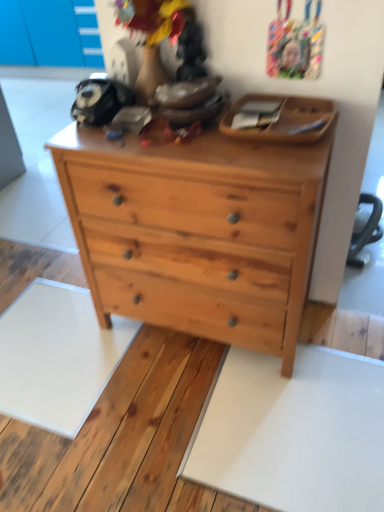
Question: Should I look upward or downward to see natural wood chest of drawers at center?

Choices:
 (A) up
 (B) down

Answer: (A)